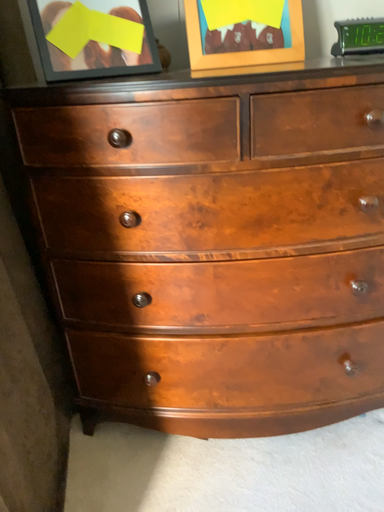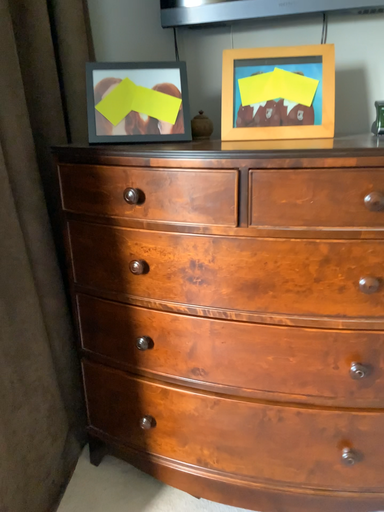
Question: Which way did the camera rotate in the video?

Choices:
 (A) rotated right
 (B) rotated left

Answer: (B)